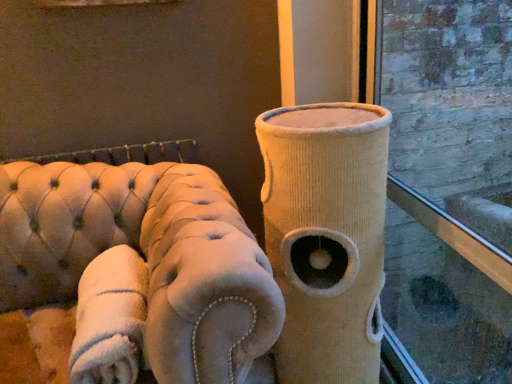
Question: Is beige tufted sofa at left beside beige corduroy cat tower at center?

Choices:
 (A) no
 (B) yes

Answer: (A)

Question: Does beige tufted sofa at left turn towards beige corduroy cat tower at center?

Choices:
 (A) no
 (B) yes

Answer: (A)

Question: Would you consider beige tufted sofa at left to be distant from beige corduroy cat tower at center?

Choices:
 (A) yes
 (B) no

Answer: (B)

Question: Is beige tufted sofa at left shorter than beige corduroy cat tower at center?

Choices:
 (A) no
 (B) yes

Answer: (B)

Question: Would you say beige tufted sofa at left is outside beige corduroy cat tower at center?

Choices:
 (A) yes
 (B) no

Answer: (A)

Question: Is beige corduroy cat tower at center inside or outside of beige tufted sofa at left?

Choices:
 (A) inside
 (B) outside

Answer: (B)

Question: From the image's perspective, is beige corduroy cat tower at center above or below beige tufted sofa at left?

Choices:
 (A) above
 (B) below

Answer: (A)

Question: Does point (288, 139) appear closer or farther from the camera than point (65, 226)?

Choices:
 (A) farther
 (B) closer

Answer: (B)

Question: Looking at their shapes, would you say beige corduroy cat tower at center is wider or thinner than beige tufted sofa at left?

Choices:
 (A) wide
 (B) thin

Answer: (B)

Question: Is beige corduroy cat tower at center wider or thinner than white plush blanket at lower left?

Choices:
 (A) wide
 (B) thin

Answer: (A)

Question: Is beige corduroy cat tower at center taller or shorter than white plush blanket at lower left?

Choices:
 (A) short
 (B) tall

Answer: (B)

Question: From the image's perspective, relative to white plush blanket at lower left, is beige corduroy cat tower at center above or below?

Choices:
 (A) below
 (B) above

Answer: (B)

Question: From a real-world perspective, is beige corduroy cat tower at center positioned above or below white plush blanket at lower left?

Choices:
 (A) above
 (B) below

Answer: (B)

Question: From the image's perspective, is beige tufted sofa at left located above or below white plush blanket at lower left?

Choices:
 (A) below
 (B) above

Answer: (A)

Question: Relative to white plush blanket at lower left, is beige tufted sofa at left in front or behind?

Choices:
 (A) front
 (B) behind

Answer: (A)